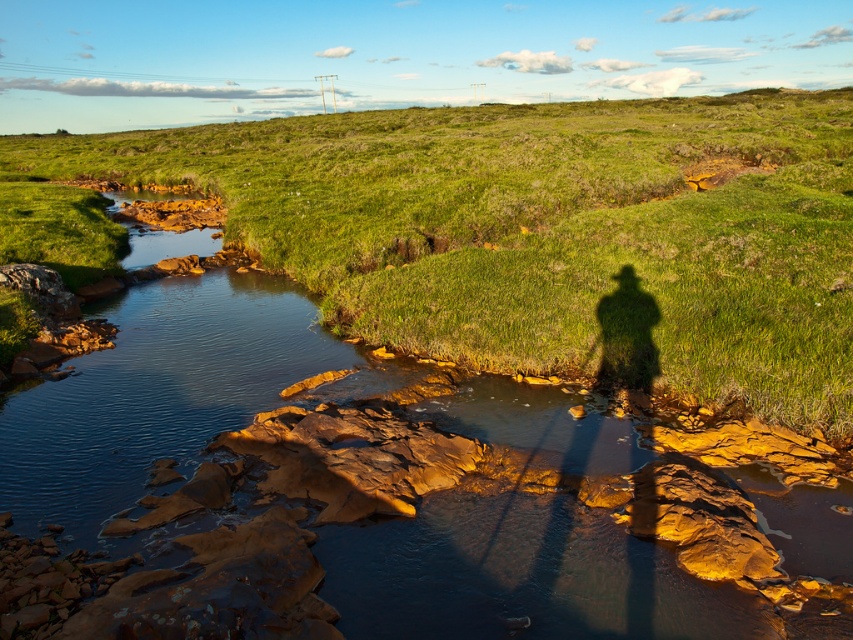
Is green grassy at upper center taller than smooth rock stream at center?

Yes, green grassy at upper center is taller than smooth rock stream at center.

Is green grassy at upper center in front of smooth rock stream at center?

No, it is behind smooth rock stream at center.

Measure the distance between point [561,148] and camera.

Point [561,148] and camera are 132.90 feet apart from each other.

Locate an element on the screen. Image resolution: width=853 pixels, height=640 pixels. green grassy at upper center is located at coordinates (547, 232).